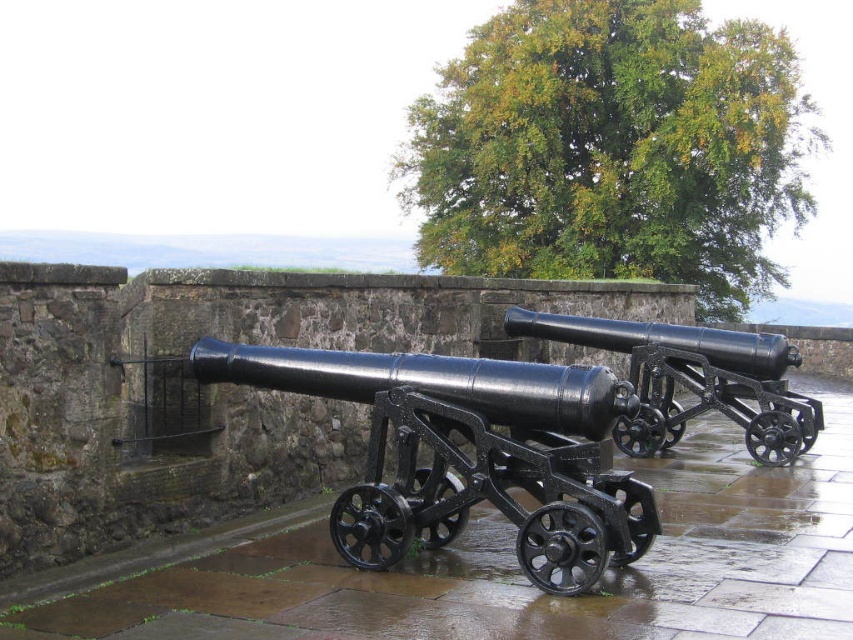
Question: Does matte black cannon at center have a greater width compared to black matte cannon at center?

Choices:
 (A) yes
 (B) no

Answer: (A)

Question: Is matte black cannon at center bigger than black matte cannon at center?

Choices:
 (A) no
 (B) yes

Answer: (B)

Question: Which point is farther from the camera taking this photo?

Choices:
 (A) (730, 372)
 (B) (532, 451)

Answer: (A)

Question: Which point is farther from the camera taking this photo?

Choices:
 (A) (358, 529)
 (B) (743, 387)

Answer: (B)

Question: Is matte black cannon at center below black matte cannon at center?

Choices:
 (A) yes
 (B) no

Answer: (B)